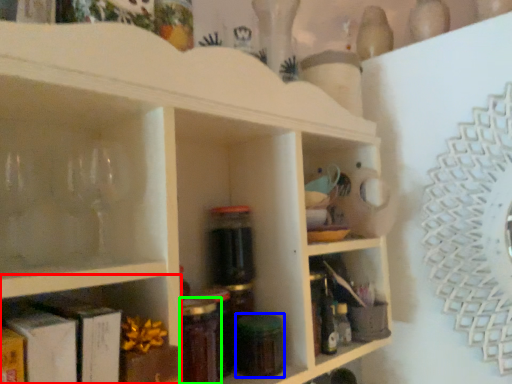
Question: Estimate the real-world distances between objects in this image. Which object is closer to shelf (highlighted by a red box), glass jar (highlighted by a blue box) or bottle (highlighted by a green box)?

Choices:
 (A) glass jar
 (B) bottle

Answer: (B)